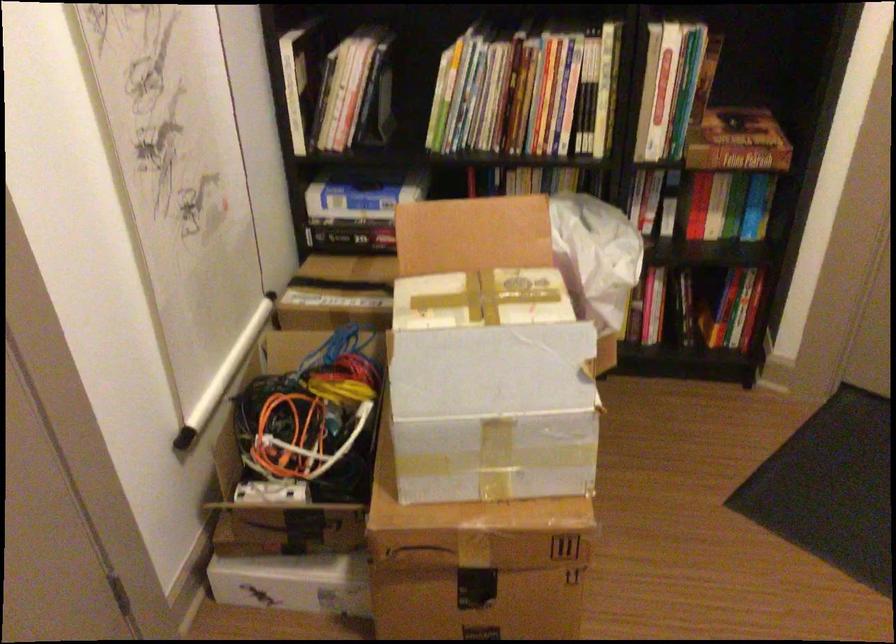
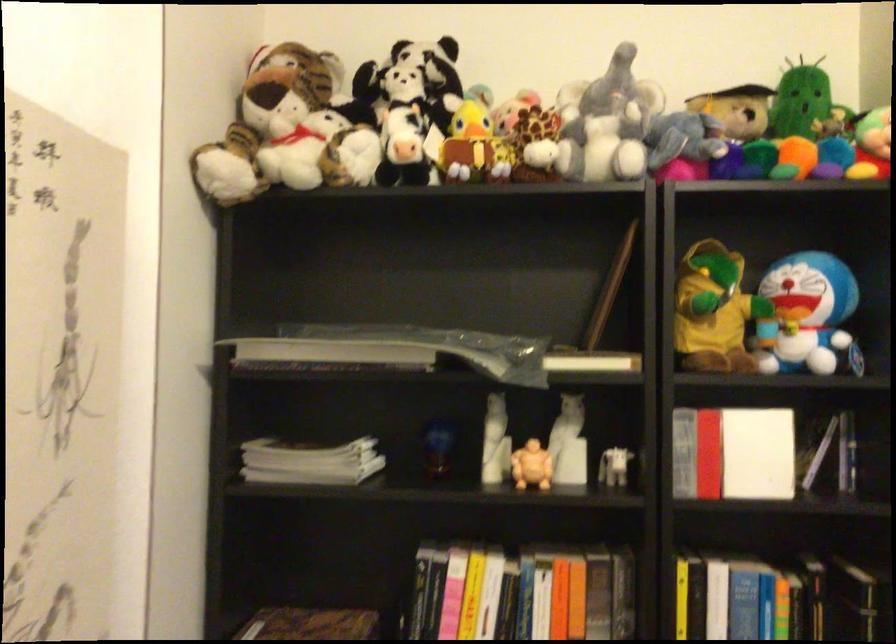
Question: The first image is from the beginning of the video and the second image is from the end. How did the camera likely rotate when shooting the video?

Choices:
 (A) Left
 (B) Right
 (C) Up
 (D) Down

Answer: (C)